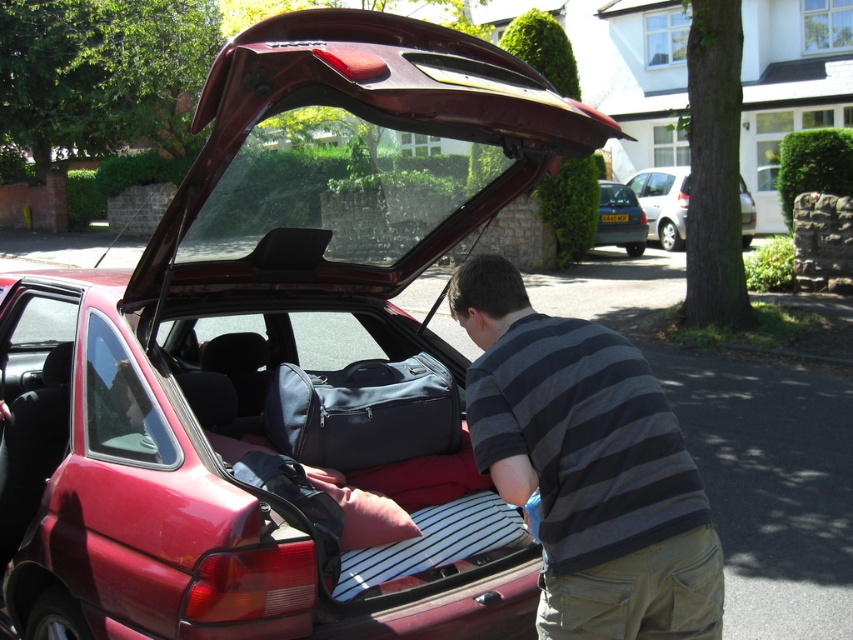
Does striped cotton shirt at center have a lesser width compared to metallic silver hatchback at center?

Yes.

Who is more forward, (566, 636) or (634, 212)?

Point (566, 636) is more forward.

Locate an element on the screen. The height and width of the screenshot is (640, 853). striped cotton shirt at center is located at coordinates (589, 467).

Does point (670, 221) lie in front of point (628, 250)?

No, it is not.

Does silver metallic hatchback at center have a greater height compared to metallic silver hatchback at center?

Indeed, silver metallic hatchback at center has a greater height compared to metallic silver hatchback at center.

Who is more distant from viewer, (646, 198) or (612, 221)?

The point (646, 198) is behind.

Find the location of a particular element. silver metallic hatchback at center is located at coordinates (663, 204).

Does shiny red car at center have a lesser width compared to metallic silver hatchback at center?

Indeed, shiny red car at center has a lesser width compared to metallic silver hatchback at center.

Who is positioned more to the right, shiny red car at center or metallic silver hatchback at center?

From the viewer's perspective, metallic silver hatchback at center appears more on the right side.

Describe the element at coordinates (281, 356) in the screenshot. I see `shiny red car at center` at that location.

Where is `shiny red car at center`? This screenshot has width=853, height=640. shiny red car at center is located at coordinates (281, 356).